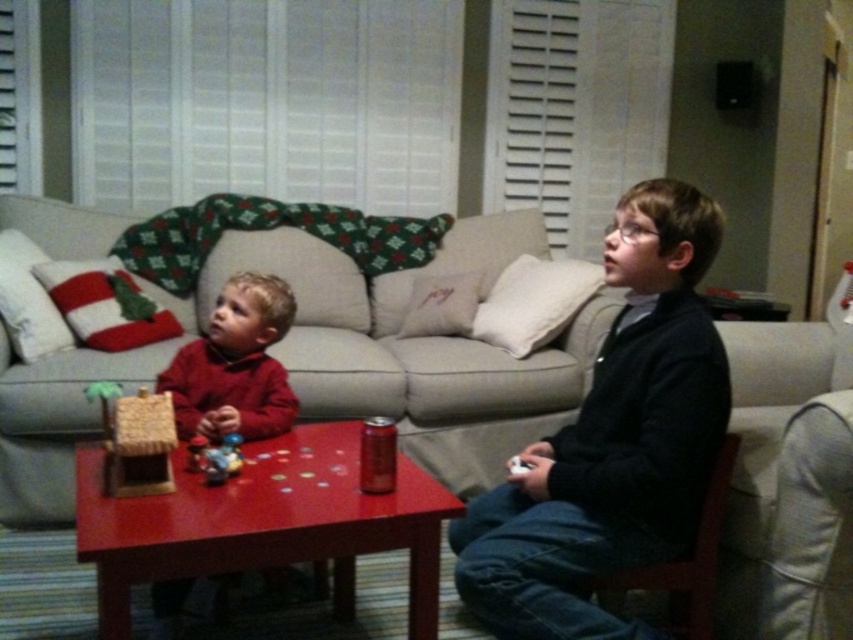
You are a delivery robot that needs to place a small package between the beige fabric couch at center and the plastic toy at center. The package requires 0.5 meters of space. Can you fit the package in that space?

The beige fabric couch at center is 1.06 meters away from the plastic toy at center, so yes, the package requiring 0.5 meters of space can be placed between them as there is sufficient space.

What is the color of the sweater worn by the child located at the coordinates point (235,364)?

The color of the sweater at point (235,364) is red.